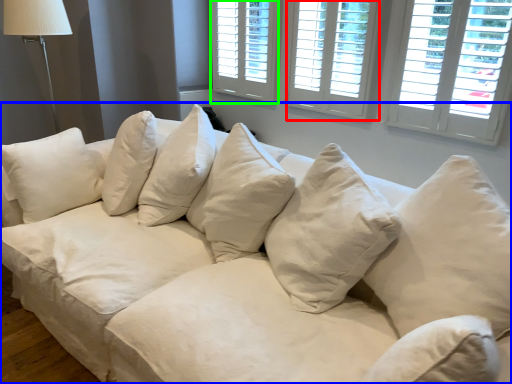
Question: Considering the real-world distances, which object is closest to window (highlighted by a red box)? studio couch (highlighted by a blue box) or window (highlighted by a green box).

Choices:
 (A) studio couch
 (B) window

Answer: (B)